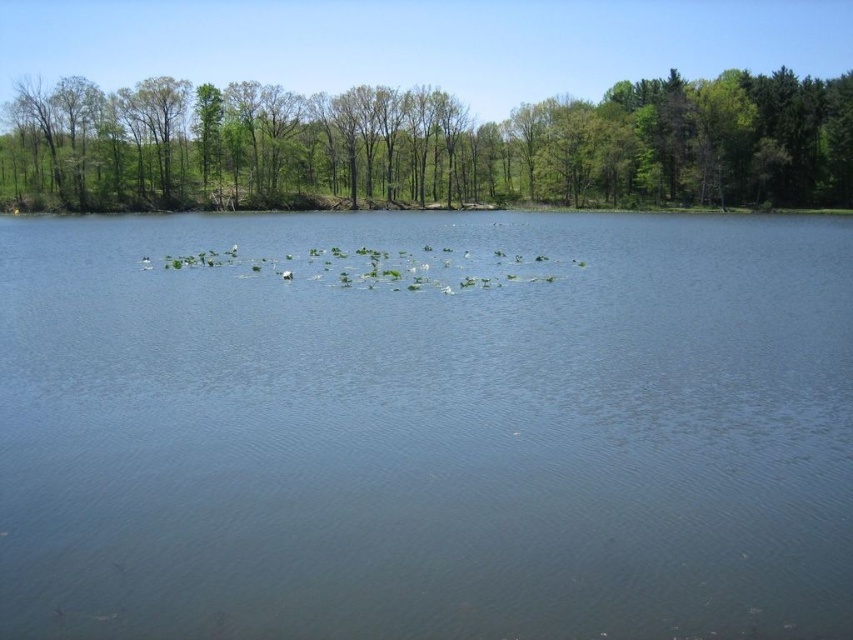
Question: Is clear blue water at center in front of green leafy trees at upper center?

Choices:
 (A) yes
 (B) no

Answer: (A)

Question: In this image, where is clear blue water at center located relative to green leafy trees at upper center?

Choices:
 (A) left
 (B) right

Answer: (A)

Question: Which of the following is the farthest from the observer?

Choices:
 (A) clear blue water at center
 (B) green leafy trees at upper center

Answer: (B)

Question: Among these objects, which one is farthest from the camera?

Choices:
 (A) green leafy trees at upper center
 (B) clear blue water at center

Answer: (A)

Question: Can you confirm if clear blue water at center is positioned above green leafy trees at upper center?

Choices:
 (A) no
 (B) yes

Answer: (A)